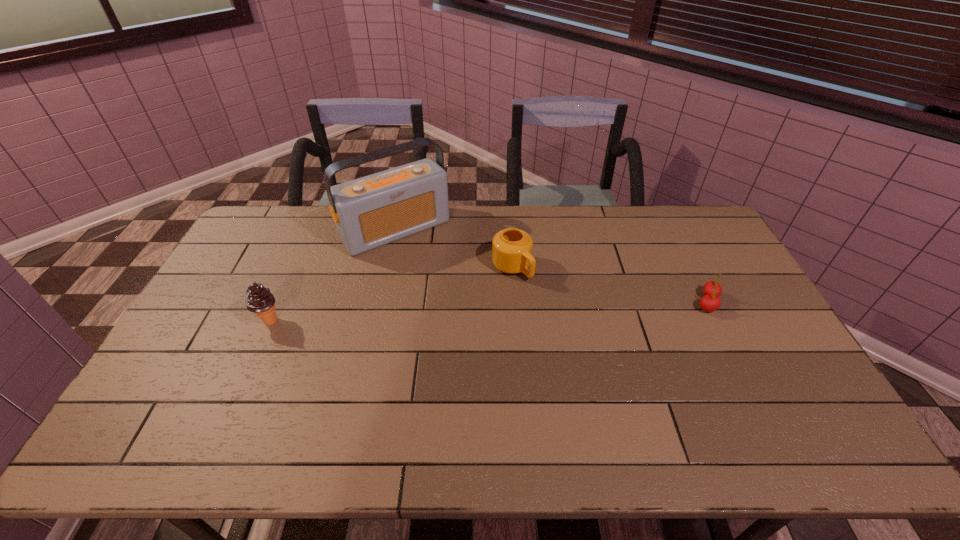
The image size is (960, 540). In order to click on the third shortest object in this screenshot , I will do `click(260, 300)`.

Identify the location of the leftmost object. Image resolution: width=960 pixels, height=540 pixels. (260, 300).

Identify the location of the shortest object. tap(712, 290).

Identify the location of the rightmost object. The width and height of the screenshot is (960, 540). (712, 290).

At what (x,y) coordinates should I click in order to perform the action: click on mug. Please return your answer as a coordinate pair (x, y). The image size is (960, 540). Looking at the image, I should click on (511, 248).

The image size is (960, 540). What are the coordinates of `the second shortest object` in the screenshot? It's located at (511, 248).

This screenshot has height=540, width=960. I want to click on the third object from right to left, so click(369, 212).

Where is `the tallest object`? the tallest object is located at coordinates (369, 212).

What are the coordinates of `free spot located 0.060m on the back of the icecream` in the screenshot? It's located at (281, 296).

Where is `free space located on the left of the cherry`? This screenshot has width=960, height=540. free space located on the left of the cherry is located at coordinates (581, 302).